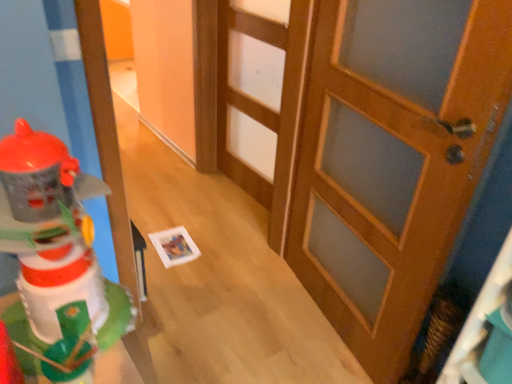
Question: From a real-world perspective, is plastic toy robot at left above or below wooden door at center, the 2th door positioned from the front?

Choices:
 (A) below
 (B) above

Answer: (B)

Question: Is plastic toy robot at left spatially inside wooden door at center, the 1th door from the back, or outside of it?

Choices:
 (A) outside
 (B) inside

Answer: (A)

Question: Estimate the real-world distances between objects in this image. Which object is closer to the plastic toy robot at left?

Choices:
 (A) wooden door at center, which is counted as the 2th door, starting from the left
 (B) wooden door at center, the 1th door viewed from the left

Answer: (A)

Question: Considering the real-world distances, which object is farthest from the wooden door at center, which is counted as the 2th door, starting from the left?

Choices:
 (A) plastic toy robot at left
 (B) wooden door at center, the 1th door viewed from the left

Answer: (A)